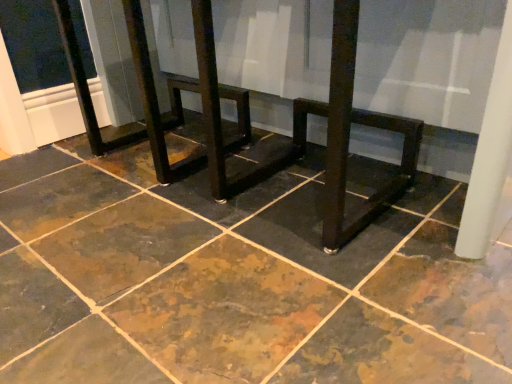
Question: Considering the positions of point (409, 173) and point (133, 322), is point (409, 173) closer or farther from the camera than point (133, 322)?

Choices:
 (A) farther
 (B) closer

Answer: (A)

Question: From a real-world perspective, is matte dark wood table at center positioned above or below marbled stone floor at center?

Choices:
 (A) above
 (B) below

Answer: (A)

Question: Choose the correct answer: Is matte dark wood table at center inside marbled stone floor at center or outside it?

Choices:
 (A) outside
 (B) inside

Answer: (A)

Question: Based on their positions, is marbled stone floor at center located to the left or right of matte dark wood table at center?

Choices:
 (A) left
 (B) right

Answer: (A)

Question: Looking at their shapes, would you say marbled stone floor at center is wider or thinner than matte dark wood table at center?

Choices:
 (A) thin
 (B) wide

Answer: (B)

Question: From the image's perspective, is marbled stone floor at center located above or below matte dark wood table at center?

Choices:
 (A) below
 (B) above

Answer: (A)

Question: Is marbled stone floor at center spatially inside matte dark wood table at center, or outside of it?

Choices:
 (A) outside
 (B) inside

Answer: (A)